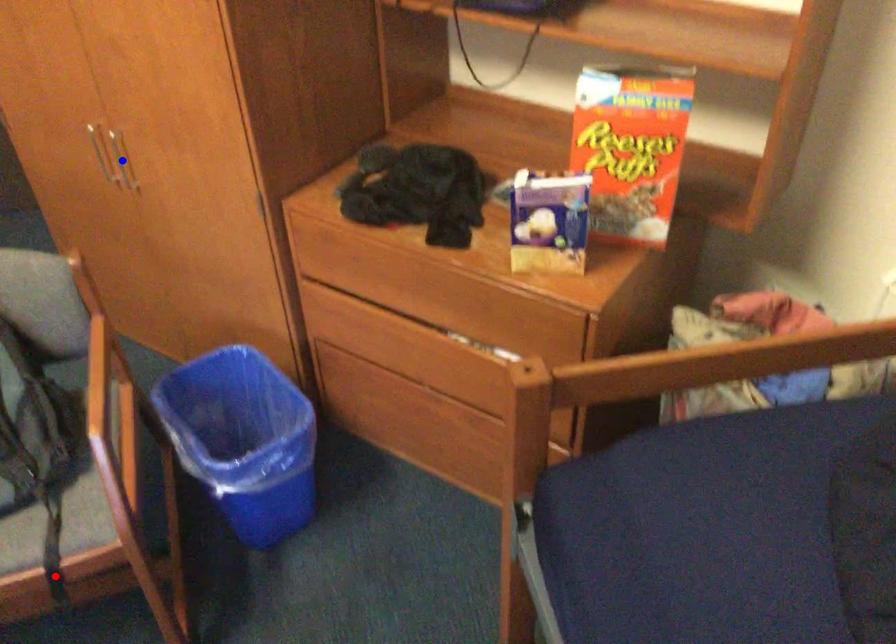
Question: Two points are marked on the image. Which point is closer to the camera?

Choices:
 (A) Blue point is closer.
 (B) Red point is closer.

Answer: (B)